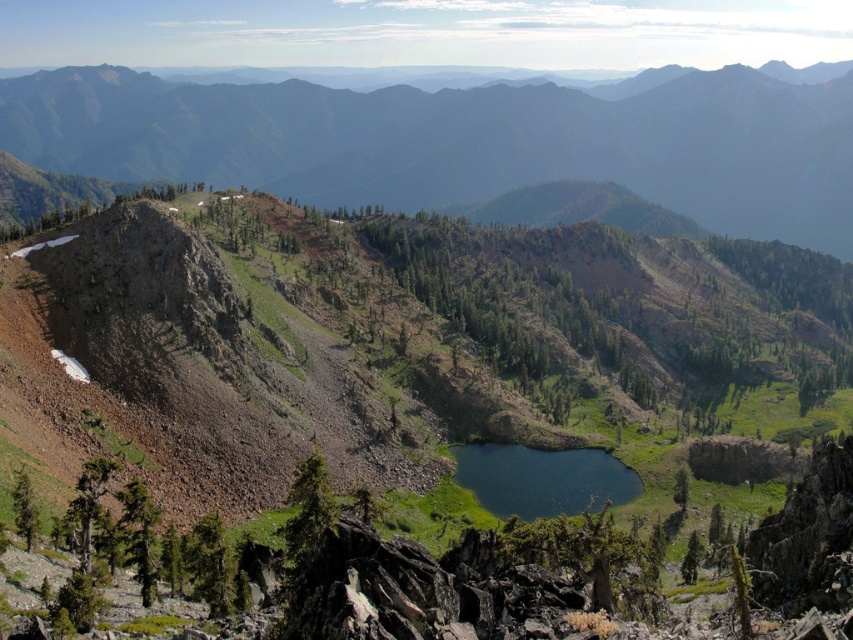
Question: Is the position of green grassy mountain at upper center more distant than that of deep blue water at center?

Choices:
 (A) yes
 (B) no

Answer: (A)

Question: Which object appears farthest from the camera in this image?

Choices:
 (A) green grassy mountain at upper center
 (B) deep blue water at center

Answer: (A)

Question: In this image, where is green grassy mountain at upper center located relative to deep blue water at center?

Choices:
 (A) below
 (B) above

Answer: (B)

Question: Which point is closer to the camera taking this photo?

Choices:
 (A) (537, 464)
 (B) (138, 129)

Answer: (A)

Question: Can you confirm if green grassy mountain at upper center is wider than deep blue water at center?

Choices:
 (A) no
 (B) yes

Answer: (B)